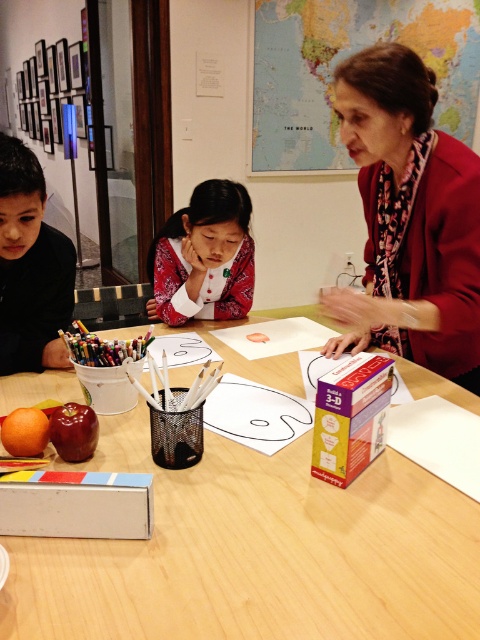
You are a student in the classroom and need to place a new item on the table. The new item is the same size as the cardboard box at center. Where should you place it so that it doesn not block the matte pink blouse at center?

Since the matte pink blouse at center is larger than the cardboard box at center, placing the new item near the edge of the table away from the blouse would prevent blocking it. The cardboard box at center is smaller, so positioning the new item opposite to the blouse ensures visibility and accessibility.

You are standing in the classroom and want to know where the black matte boy at left is located. Can you tell me its exact position on the table?

The black matte boy at left is located at the 2D coordinates point [31,268] on the table.

You are a teacher in the classroom. You need to place a new poster on the wall behind the black matte boy at left and the cardboard box at center. Which object should you move first to make space?

The black matte boy at left is bigger than the cardboard box at center, so you should move the black matte boy at left first to create enough space for the poster.